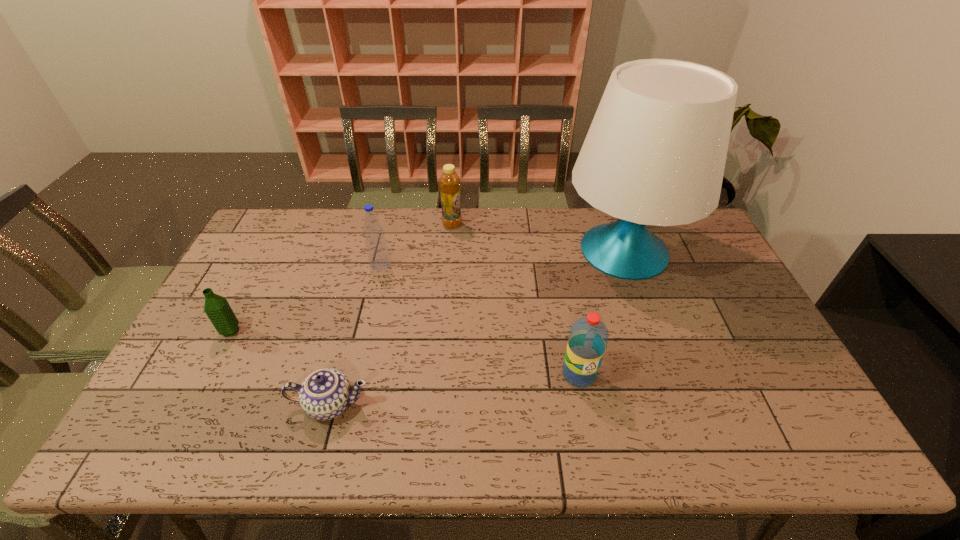
Identify the location of vacant point located between the nearest water bottle and the farthest water bottle. This screenshot has height=540, width=960. (480, 319).

This screenshot has width=960, height=540. In order to click on free space between the farthest water bottle and the chinaware in this screenshot , I will do `click(355, 334)`.

Where is `vacant space that's between the second water bottle from left to right and the rightmost water bottle`? Image resolution: width=960 pixels, height=540 pixels. vacant space that's between the second water bottle from left to right and the rightmost water bottle is located at coordinates (480, 319).

This screenshot has height=540, width=960. I want to click on empty space between the shortest object and the table lamp, so click(x=477, y=328).

Locate an element on the screen. the fifth closest object to the bottle is located at coordinates (218, 310).

Find the location of `object that stands as the fourth closest to the tallest object`. object that stands as the fourth closest to the tallest object is located at coordinates (325, 394).

Identify which water bottle is located as the nearest to the rightmost water bottle. Please provide its 2D coordinates. Your answer should be formatted as a tuple, i.e. [(x, y)], where the tuple contains the x and y coordinates of a point satisfying the conditions above.

[(376, 246)]

Where is `water bottle that is the second closest to the rightmost water bottle`? water bottle that is the second closest to the rightmost water bottle is located at coordinates (218, 310).

The image size is (960, 540). Identify the location of vacant space that satisfies the following two spatial constraints: 1. on the front-facing side of the tallest object; 2. at the spout of the chinaware. (679, 404).

You are a GUI agent. You are given a task and a screenshot of the screen. Output one action in this format:
    pyautogui.click(x=<x>, y=<y>)
    Task: Click on the vacant space that satisfies the following two spatial constraints: 1. on the back side of the bottle; 2. on the left side of the shortest water bottle
    
    Given the screenshot: What is the action you would take?
    pyautogui.click(x=286, y=225)